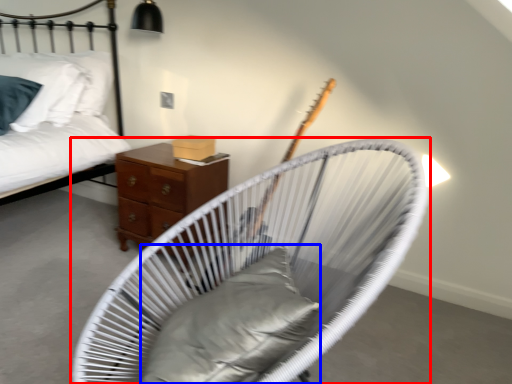
Question: Which point is further to the camera, furniture (highlighted by a red box) or pillow (highlighted by a blue box)?

Choices:
 (A) furniture
 (B) pillow

Answer: (B)